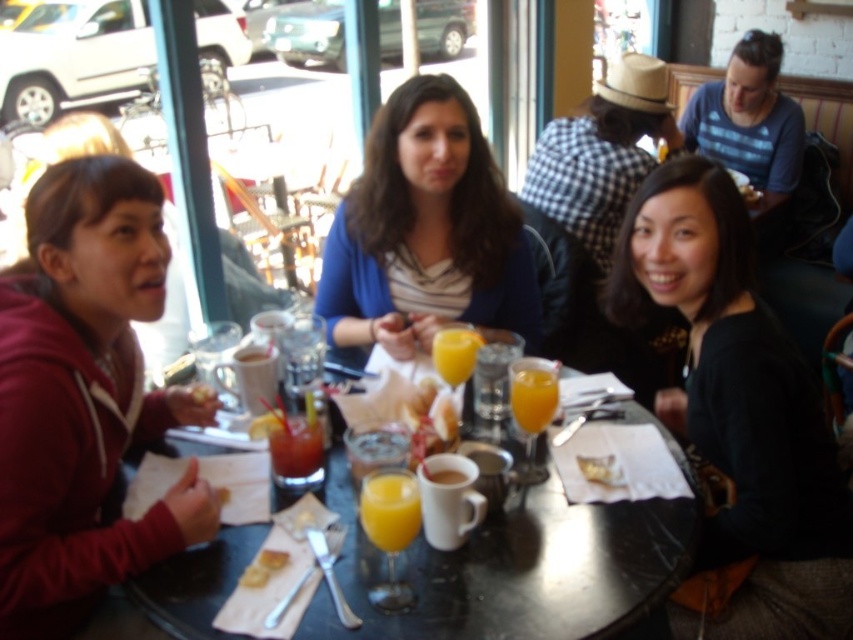
Question: Is black glass table at center to the right of matte brown bread at table center from the viewer's perspective?

Choices:
 (A) no
 (B) yes

Answer: (B)

Question: Among these objects, which one is nearest to the camera?

Choices:
 (A) golden brown bread at center
 (B) translucent glass orange juice at center
 (C) blue cardigan at center

Answer: (A)

Question: Is black matte shirt at lower right wider than matte brown bread at table center?

Choices:
 (A) no
 (B) yes

Answer: (B)

Question: Is orange liquid glass at center bigger than golden crumbly bread at center?

Choices:
 (A) yes
 (B) no

Answer: (A)

Question: Among these objects, which one is nearest to the camera?

Choices:
 (A) orange liquid glass at center
 (B) translucent glass orange juice at center
 (C) white matte mug at center

Answer: (A)

Question: Which point is closer to the camera?

Choices:
 (A) (410, 90)
 (B) (418, 506)

Answer: (B)